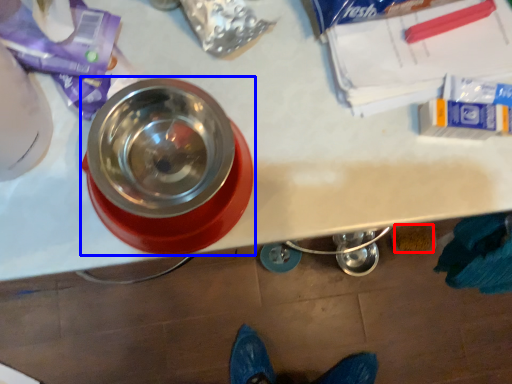
Question: Which of the following is the farthest to the observer, debris (highlighted by a red box) or tableware (highlighted by a blue box)?

Choices:
 (A) debris
 (B) tableware

Answer: (A)